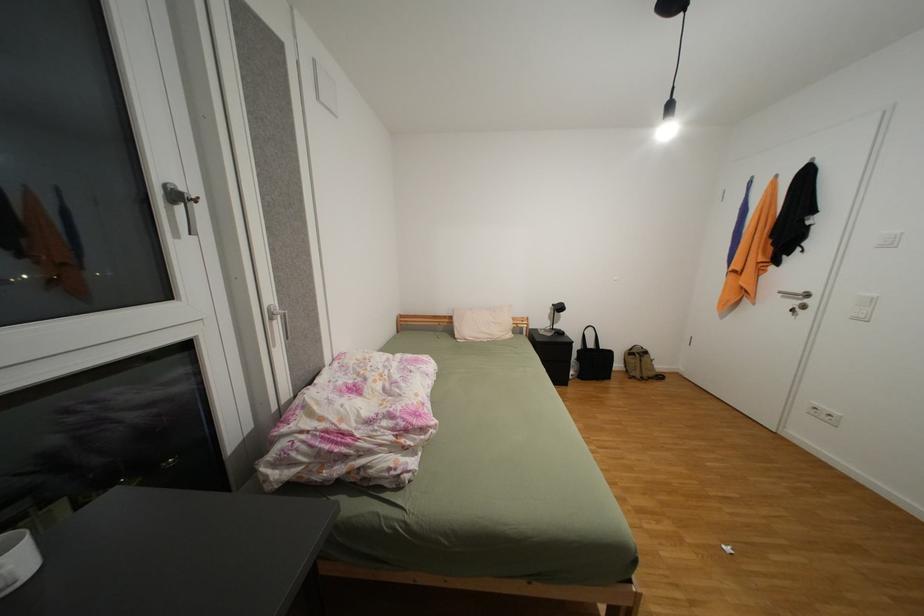
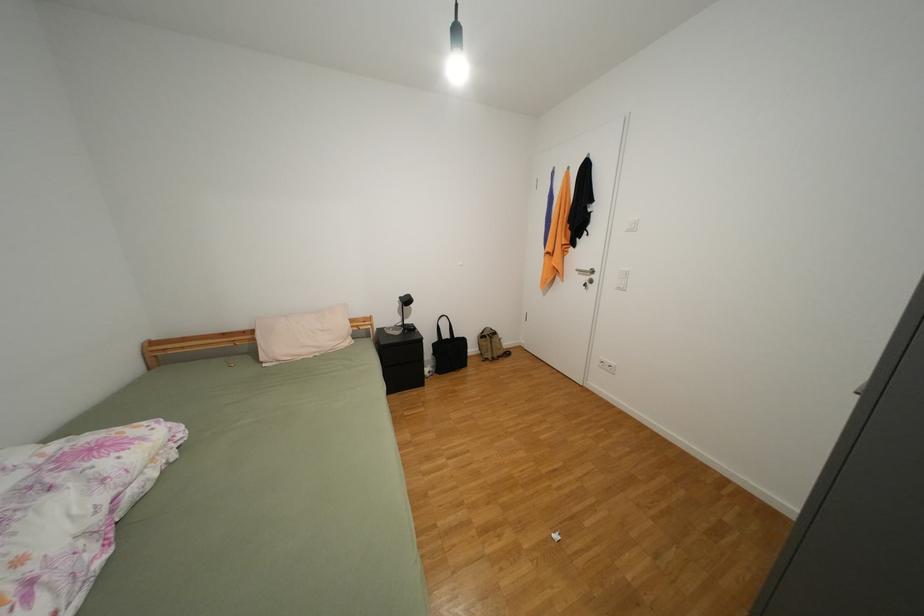
In a continuous first-person perspective shot, in which direction is the camera moving?

The movement direction of the cameraman is right, forward.